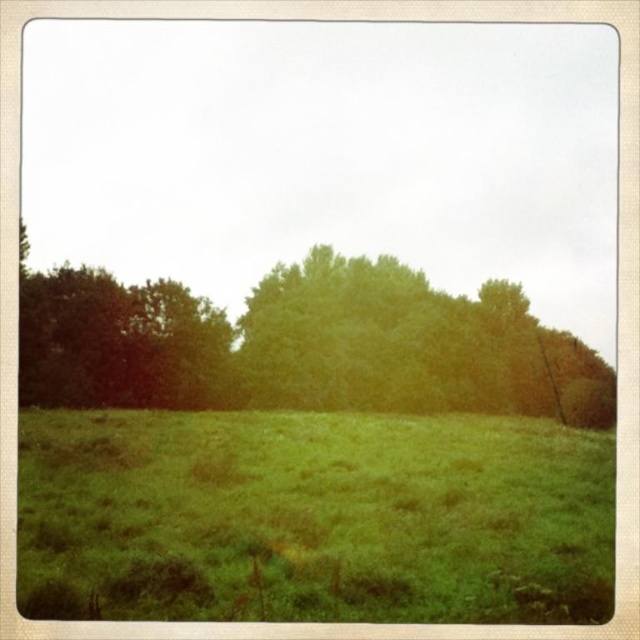
Describe the element at coordinates (314, 516) in the screenshot. I see `green grassy field at center` at that location.

The height and width of the screenshot is (640, 640). In order to click on green grassy field at center in this screenshot , I will do `click(314, 516)`.